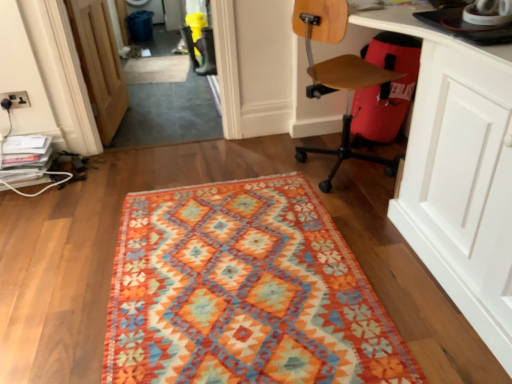
This screenshot has height=384, width=512. Identify the location of free spot below wooden door at left (from a real-world perspective). (124, 124).